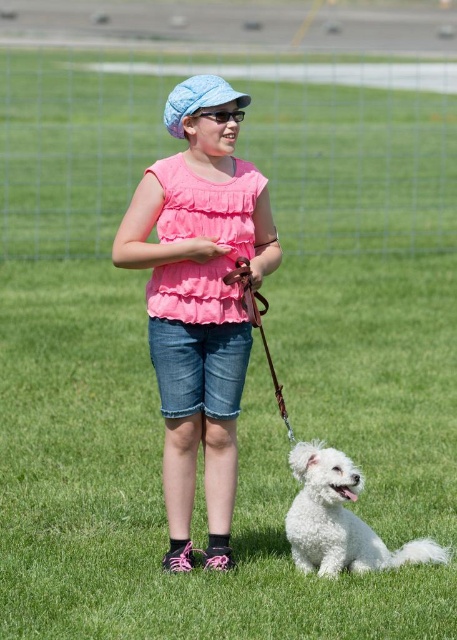
Question: Based on their relative distances, which object is farther from the brown leather leash at center?

Choices:
 (A) pink cotton shirt at center
 (B) white fluffy dog at lower right

Answer: (A)

Question: Based on their relative distances, which object is farther from the pink cotton shirt at center?

Choices:
 (A) white fluffy dog at lower right
 (B) matte black goggles at center

Answer: (A)

Question: Does brown leather leash at center lie in front of matte black goggles at center?

Choices:
 (A) no
 (B) yes

Answer: (B)

Question: Which of these objects is positioned farthest from the white fluffy dog at lower right?

Choices:
 (A) pink cotton shirt at center
 (B) matte black goggles at center

Answer: (B)

Question: Can you confirm if white fluffy dog at lower right is bigger than brown leather leash at center?

Choices:
 (A) no
 (B) yes

Answer: (B)

Question: Is white fluffy dog at lower right to the left of brown leather leash at center from the viewer's perspective?

Choices:
 (A) no
 (B) yes

Answer: (A)